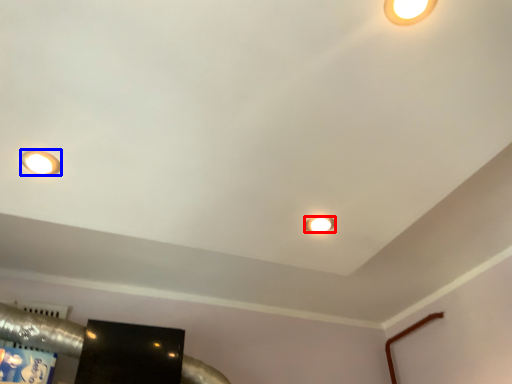
Question: Which object is further to the camera taking this photo, lamp (highlighted by a red box) or lamp (highlighted by a blue box)?

Choices:
 (A) lamp
 (B) lamp

Answer: (A)